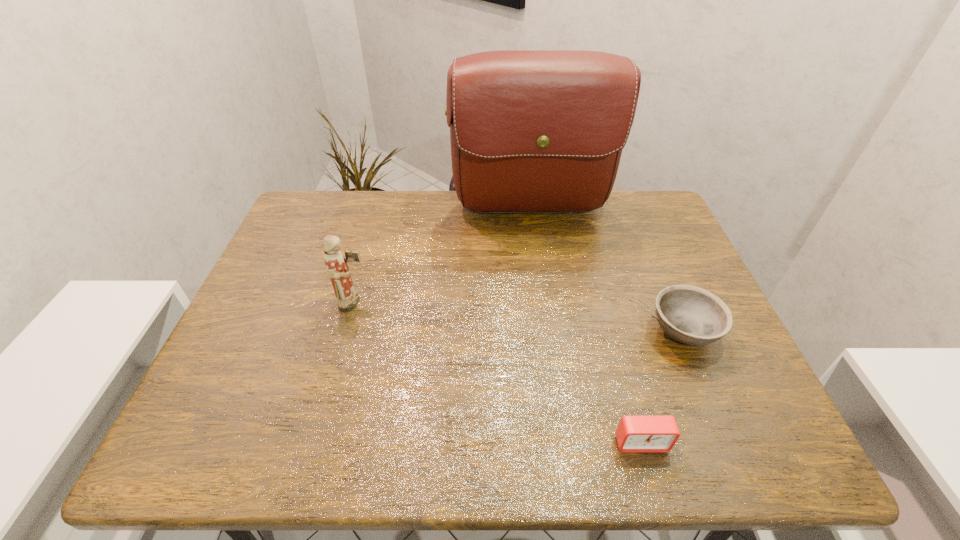
Locate an element on the screen. object that is the second nearest to the leftmost object is located at coordinates (635, 434).

This screenshot has width=960, height=540. Identify the location of vacant space that satisfies the following two spatial constraints: 1. on the open flap of the tallest object; 2. on the front-facing side of the third shortest object. (543, 303).

Find the location of a particular element. The width and height of the screenshot is (960, 540). vacant space that satisfies the following two spatial constraints: 1. on the back side of the bowl; 2. on the front-facing side of the third shortest object is located at coordinates (670, 303).

Where is `vacant position in the image that satisfies the following two spatial constraints: 1. on the open flap of the bowl; 2. on the right side of the farthest object`? vacant position in the image that satisfies the following two spatial constraints: 1. on the open flap of the bowl; 2. on the right side of the farthest object is located at coordinates (548, 333).

Where is `free space that satisfies the following two spatial constraints: 1. on the back side of the bowl; 2. on the front-facing side of the leftmost object`? The image size is (960, 540). free space that satisfies the following two spatial constraints: 1. on the back side of the bowl; 2. on the front-facing side of the leftmost object is located at coordinates (670, 303).

Where is `vacant point that satisfies the following two spatial constraints: 1. on the open flap of the tallest object; 2. on the front-facing side of the third shortest object`? The image size is (960, 540). vacant point that satisfies the following two spatial constraints: 1. on the open flap of the tallest object; 2. on the front-facing side of the third shortest object is located at coordinates (543, 303).